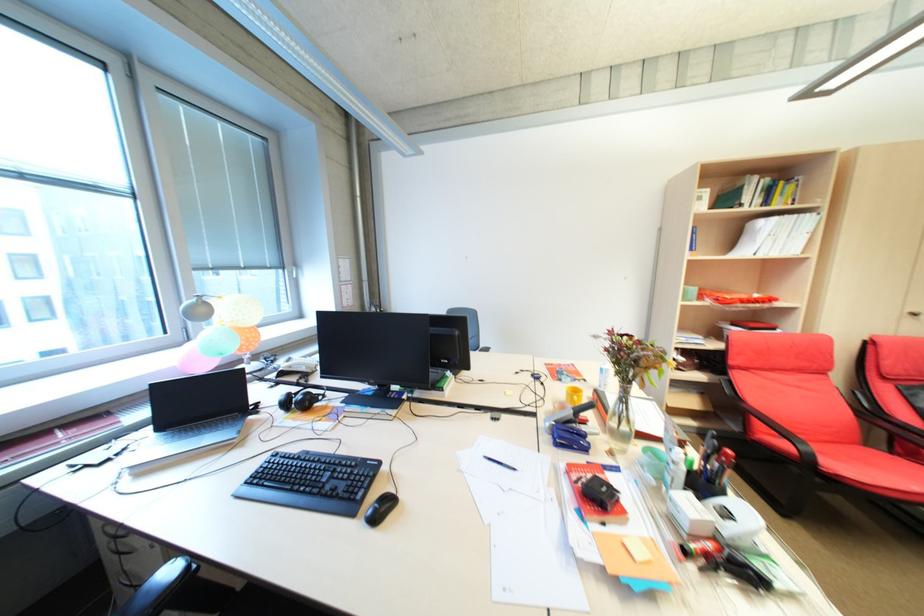
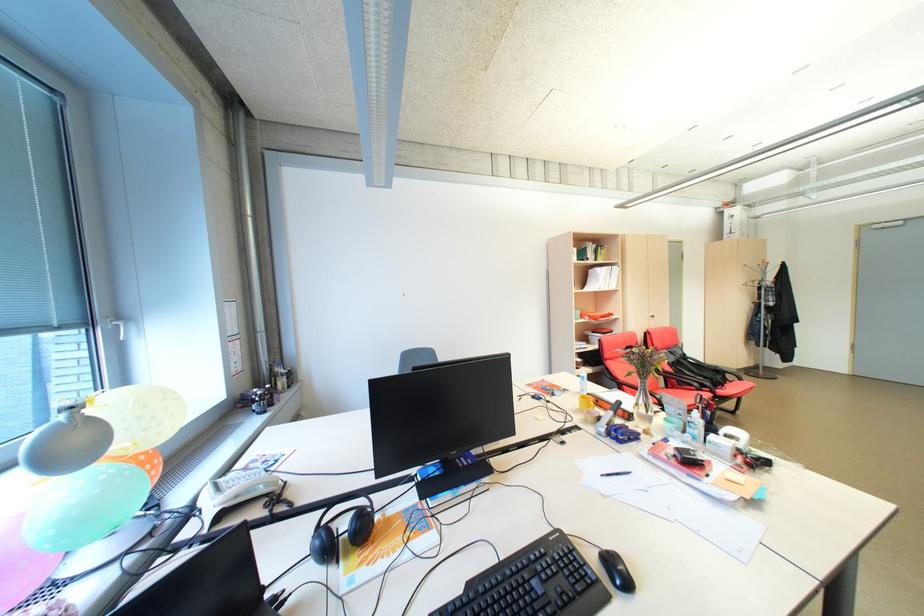
Where in the second image is the point corresponding to [585,392] from the first image?

(592, 399)